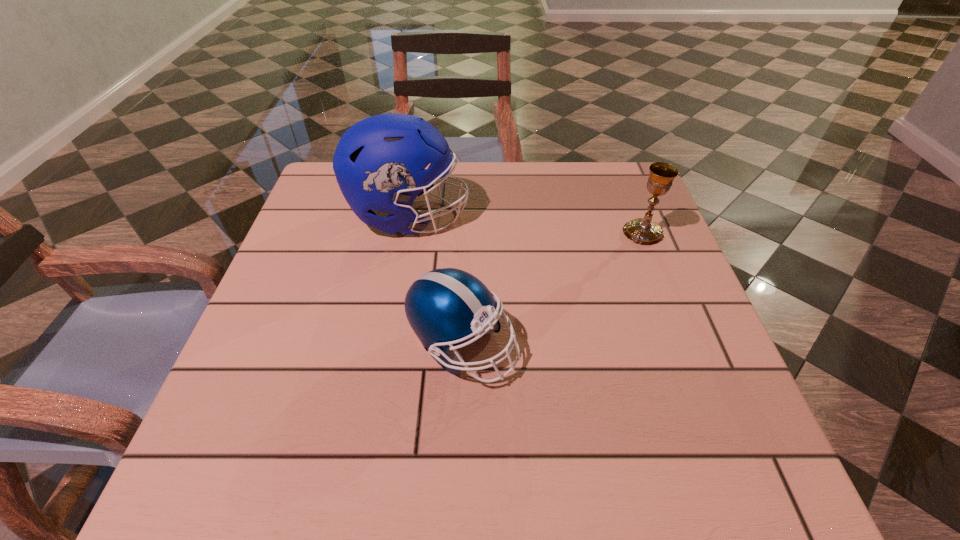
In order to click on free space between the farther football helmet and the rightmost object in this screenshot , I will do `click(526, 224)`.

The image size is (960, 540). In order to click on unoccupied position between the farther football helmet and the chalice in this screenshot , I will do `click(526, 224)`.

At what (x,y) coordinates should I click in order to perform the action: click on vacant area between the farther football helmet and the rightmost object. Please return your answer as a coordinate pair (x, y). Looking at the image, I should click on (526, 224).

Find the location of `free space that is in between the rightmost object and the taller football helmet`. free space that is in between the rightmost object and the taller football helmet is located at coordinates (526, 224).

Locate an element on the screen. object that stands as the closest to the chalice is located at coordinates (445, 307).

Where is `the second closest object to the shorter football helmet`? Image resolution: width=960 pixels, height=540 pixels. the second closest object to the shorter football helmet is located at coordinates (645, 231).

I want to click on vacant space that satisfies the following two spatial constraints: 1. on the front-facing side of the tallest object; 2. on the back side of the rightmost object, so (x=406, y=232).

Image resolution: width=960 pixels, height=540 pixels. Find the location of `free region that satisfies the following two spatial constraints: 1. on the front-facing side of the farther football helmet; 2. on the back side of the rightmost object`. free region that satisfies the following two spatial constraints: 1. on the front-facing side of the farther football helmet; 2. on the back side of the rightmost object is located at coordinates (406, 232).

This screenshot has width=960, height=540. Find the location of `free spot that satisfies the following two spatial constraints: 1. on the back side of the rightmost object; 2. on the front-facing side of the tallest object`. free spot that satisfies the following two spatial constraints: 1. on the back side of the rightmost object; 2. on the front-facing side of the tallest object is located at coordinates (636, 216).

This screenshot has width=960, height=540. Find the location of `free location that satisfies the following two spatial constraints: 1. on the back side of the rightmost object; 2. on the front-facing side of the farther football helmet`. free location that satisfies the following two spatial constraints: 1. on the back side of the rightmost object; 2. on the front-facing side of the farther football helmet is located at coordinates (636, 216).